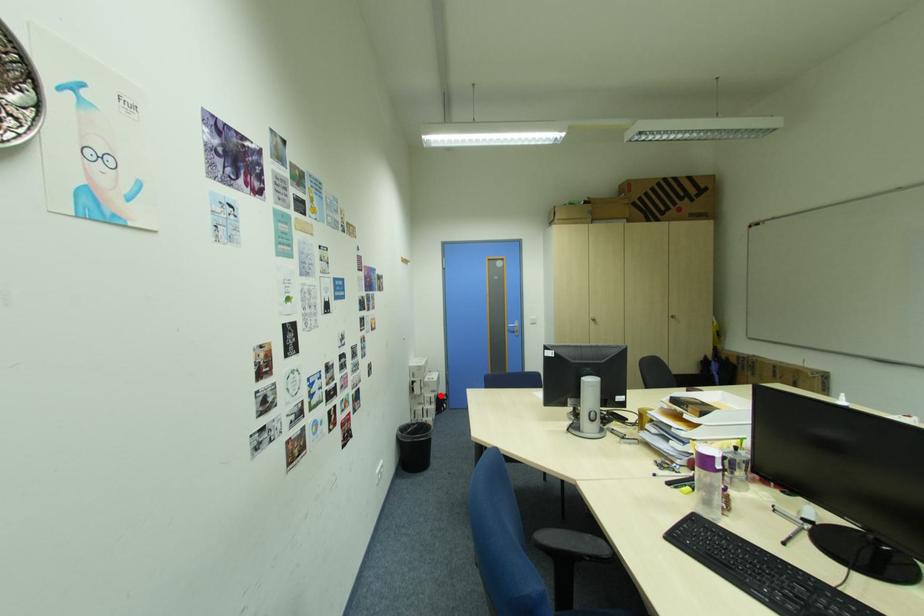
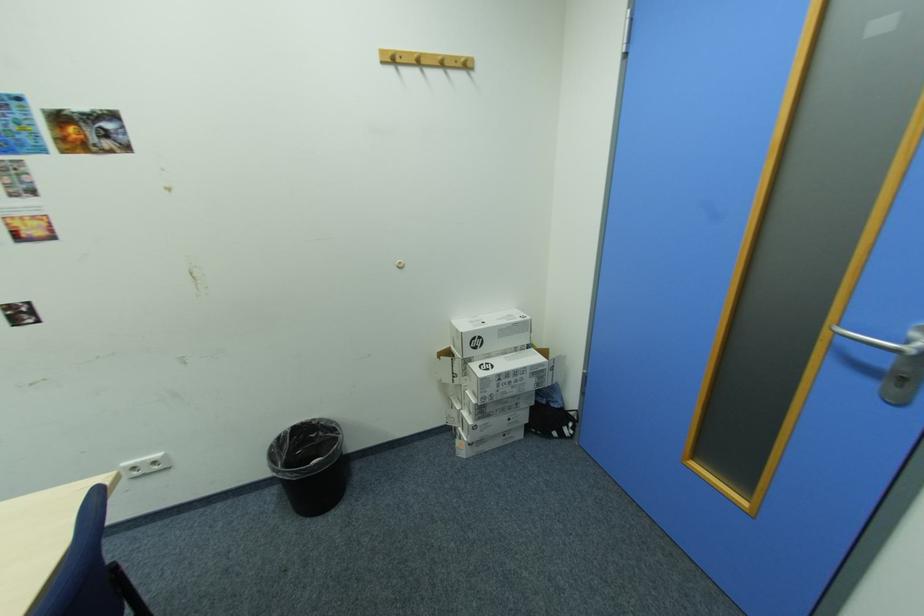
In the second image, find the point that corresponds to the highlighted location in the first image.

(481, 400)